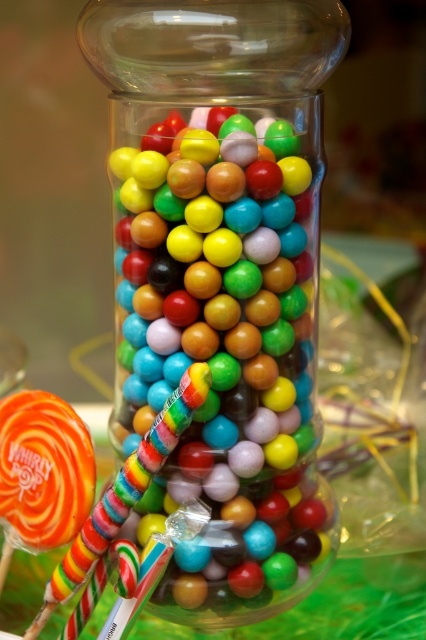
Question: Among these points, which one is nearest to the camera?

Choices:
 (A) (51, 595)
 (B) (235, 250)

Answer: (A)

Question: Does transparent glass jar at center appear over multicolored striped lollipop at lower left?

Choices:
 (A) yes
 (B) no

Answer: (A)

Question: Can you confirm if transparent glass jar at center is positioned above multicolored striped lollipop at lower left?

Choices:
 (A) no
 (B) yes

Answer: (B)

Question: Among these objects, which one is farthest from the camera?

Choices:
 (A) multicolored striped lollipop at lower left
 (B) transparent glass jar at center

Answer: (B)

Question: Does transparent glass jar at center come in front of multicolored striped lollipop at lower left?

Choices:
 (A) yes
 (B) no

Answer: (B)